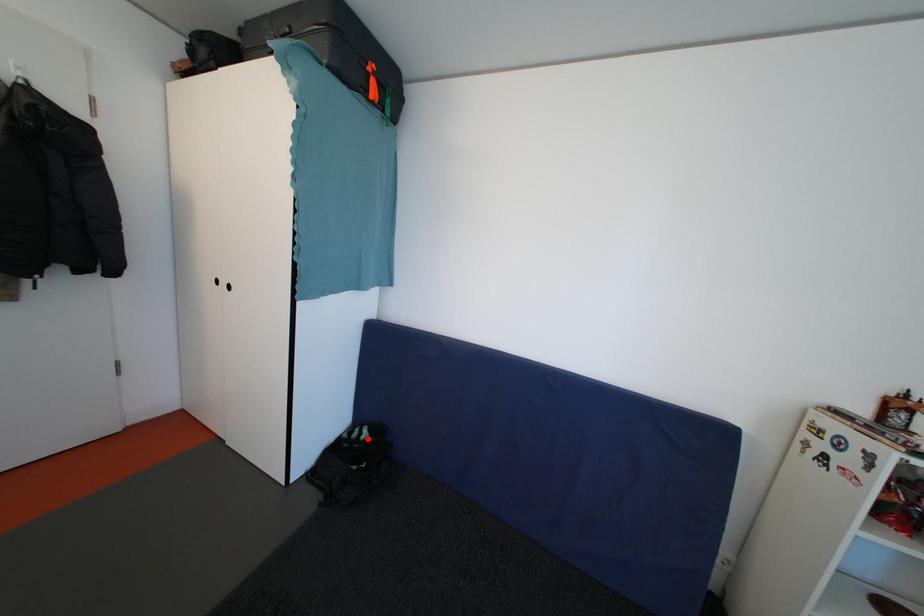
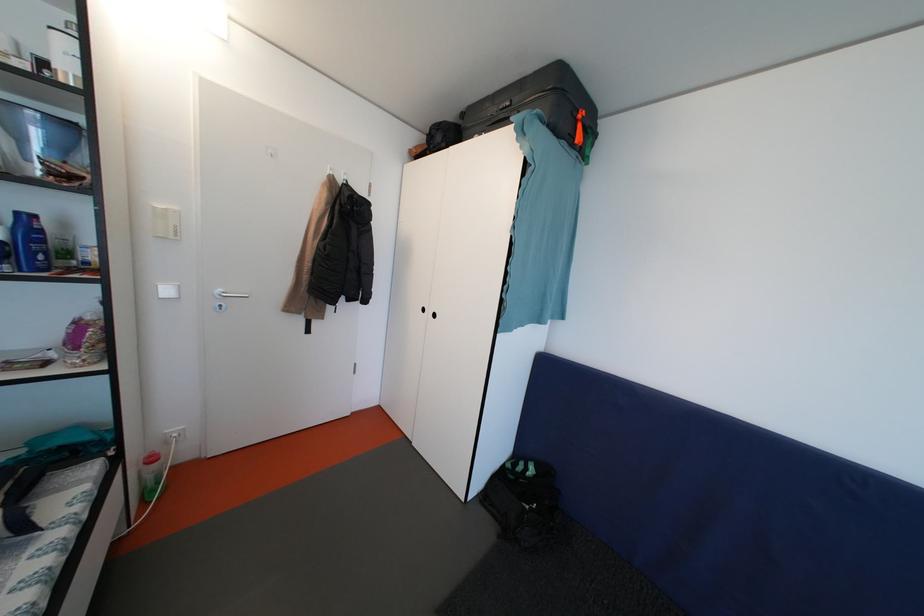
In the second image, find the point that corresponds to the highlighted location in the first image.

(533, 474)